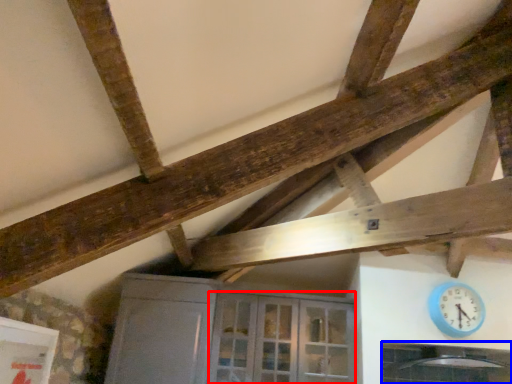
Question: Among these objects, which one is farthest to the camera, glass door (highlighted by a red box) or window (highlighted by a blue box)?

Choices:
 (A) glass door
 (B) window

Answer: (A)